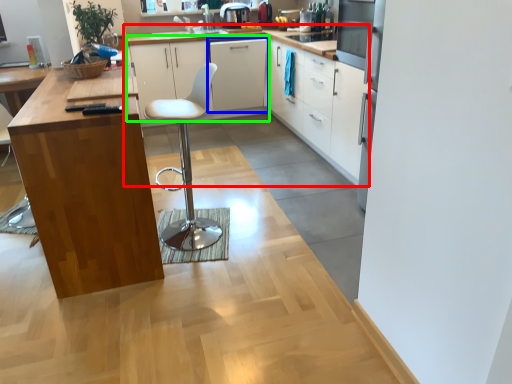
Question: Based on their relative distances, which object is farther from cabinetry (highlighted by a red box)? Choose from cabinetry (highlighted by a blue box) and cabinetry (highlighted by a green box).

Choices:
 (A) cabinetry
 (B) cabinetry

Answer: (A)